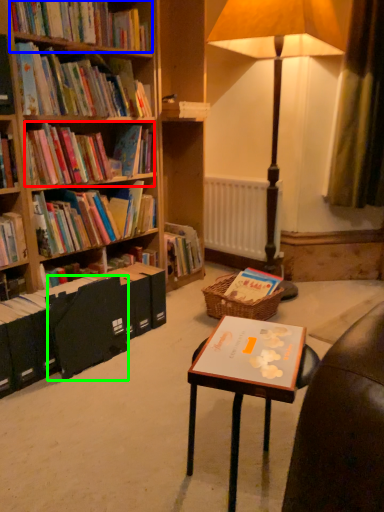
Question: Considering the real-world distances, which object is closest to book (highlighted by a red box)? book (highlighted by a blue box) or paperback book (highlighted by a green box).

Choices:
 (A) book
 (B) paperback book

Answer: (A)